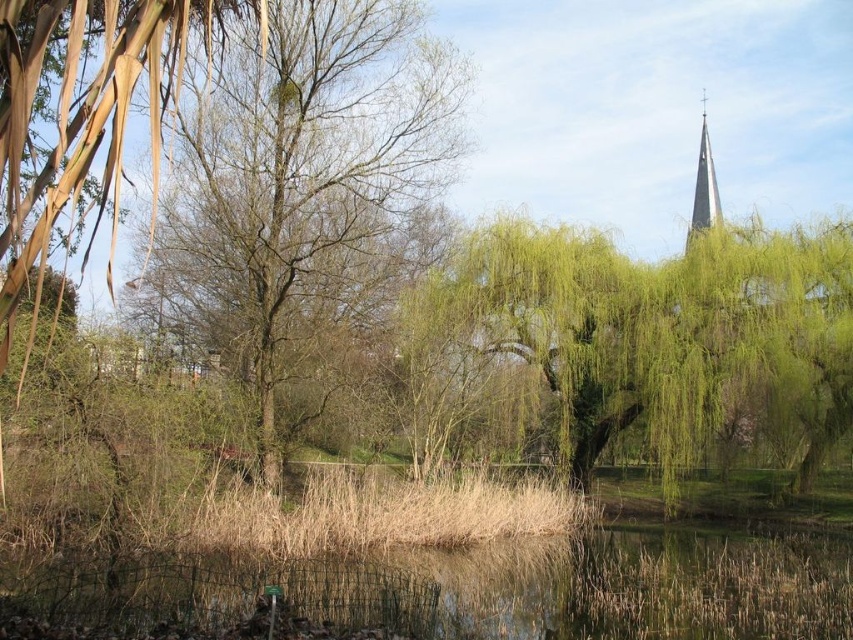
Which is below, bare branches at center or dry grass at center?

dry grass at center is lower down.

Is bare branches at center to the right of dry grass at center from the viewer's perspective?

In fact, bare branches at center is to the left of dry grass at center.

What do you see at coordinates (305, 188) in the screenshot? I see `bare branches at center` at bounding box center [305, 188].

The height and width of the screenshot is (640, 853). Find the location of `bare branches at center`. bare branches at center is located at coordinates (305, 188).

Based on the photo, does bare branches at center have a lesser height compared to green grassy water at lower center?

No.

Between point (164, 268) and point (305, 596), which one is positioned behind?

Point (164, 268)

Which is behind, point (196, 308) or point (195, 566)?

The point (196, 308) is behind.

The image size is (853, 640). What are the coordinates of `bare branches at center` in the screenshot? It's located at (305, 188).

Is green leafy willow at center bigger than smooth gray steeple at upper right?

Indeed, green leafy willow at center has a larger size compared to smooth gray steeple at upper right.

Does green leafy willow at center appear over smooth gray steeple at upper right?

No.

The width and height of the screenshot is (853, 640). I want to click on green leafy willow at center, so click(654, 337).